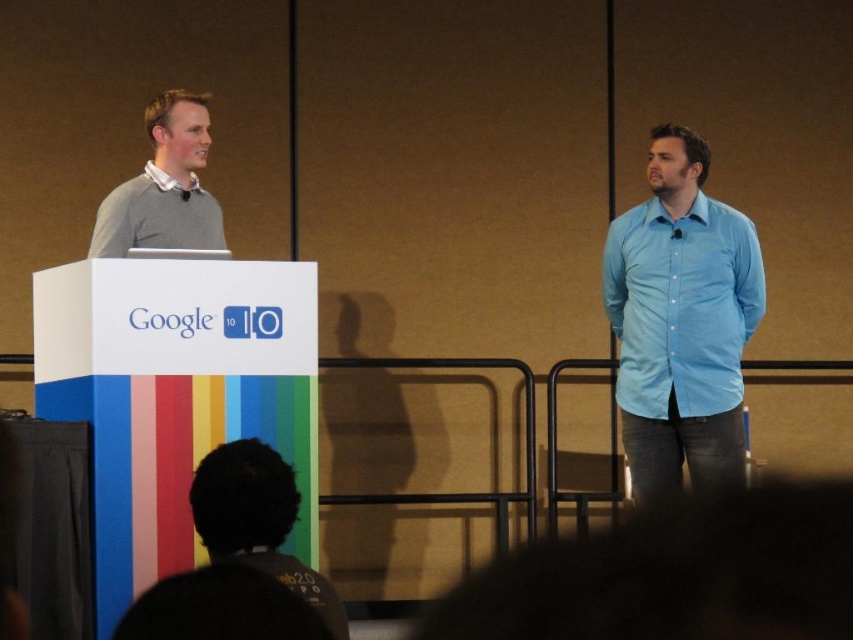
You are attending a conference and see two people in the scene. One is wearing a light blue cotton shirt at right and the other a matte gray sweater at left. Which person is standing closer to the front of the stage?

The light blue cotton shirt at right is below matte gray sweater at left, so the person in the light blue cotton shirt at right is standing closer to the front of the stage.